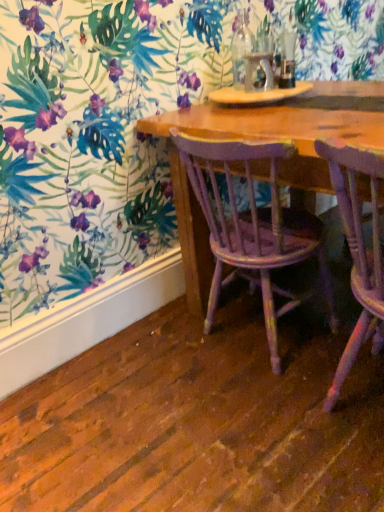
Question: In which direction should I rotate to look at distressed purple wood chair at center, arranged as the second chair when viewed from the right?

Choices:
 (A) left
 (B) right

Answer: (B)

Question: Is purple painted wood chair at lower right, the first chair viewed from the right, bigger than distressed purple wood chair at center, arranged as the second chair when viewed from the right?

Choices:
 (A) yes
 (B) no

Answer: (B)

Question: From a real-world perspective, is purple painted wood chair at lower right, the first chair viewed from the right, beneath distressed purple wood chair at center, arranged as the second chair when viewed from the right?

Choices:
 (A) yes
 (B) no

Answer: (B)

Question: Is purple painted wood chair at lower right, the first chair viewed from the right, in front of distressed purple wood chair at center, the first chair in the left-to-right sequence?

Choices:
 (A) no
 (B) yes

Answer: (B)

Question: Is purple painted wood chair at lower right, positioned as the second chair in left-to-right order, far from distressed purple wood chair at center, the first chair in the left-to-right sequence?

Choices:
 (A) no
 (B) yes

Answer: (A)

Question: Could you tell me if purple painted wood chair at lower right, positioned as the second chair in left-to-right order, is turned towards distressed purple wood chair at center, the first chair in the left-to-right sequence?

Choices:
 (A) no
 (B) yes

Answer: (A)

Question: Could distressed purple wood chair at center, arranged as the second chair when viewed from the right, be considered to be inside purple painted wood chair at lower right, the first chair viewed from the right?

Choices:
 (A) no
 (B) yes

Answer: (A)

Question: Does distressed purple wood chair at center, the first chair in the left-to-right sequence, appear on the right side of purple painted wood chair at lower right, the first chair viewed from the right?

Choices:
 (A) no
 (B) yes

Answer: (A)

Question: Can you confirm if distressed purple wood chair at center, arranged as the second chair when viewed from the right, is wider than purple painted wood chair at lower right, the first chair viewed from the right?

Choices:
 (A) no
 (B) yes

Answer: (A)

Question: Is distressed purple wood chair at center, arranged as the second chair when viewed from the right, with purple painted wood chair at lower right, positioned as the second chair in left-to-right order?

Choices:
 (A) yes
 (B) no

Answer: (B)

Question: Does distressed purple wood chair at center, the first chair in the left-to-right sequence, have a lesser height compared to purple painted wood chair at lower right, the first chair viewed from the right?

Choices:
 (A) yes
 (B) no

Answer: (A)

Question: From the image's perspective, would you say distressed purple wood chair at center, arranged as the second chair when viewed from the right, is shown under purple painted wood chair at lower right, the first chair viewed from the right?

Choices:
 (A) yes
 (B) no

Answer: (B)

Question: Is distressed purple wood chair at center, the first chair in the left-to-right sequence, to the left of purple painted wood chair at lower right, the first chair viewed from the right, from the viewer's perspective?

Choices:
 (A) yes
 (B) no

Answer: (A)

Question: Considering the positions of distressed purple wood chair at center, the first chair in the left-to-right sequence, and purple painted wood chair at lower right, the first chair viewed from the right, in the image, is distressed purple wood chair at center, the first chair in the left-to-right sequence, wider or thinner than purple painted wood chair at lower right, the first chair viewed from the right,?

Choices:
 (A) wide
 (B) thin

Answer: (B)